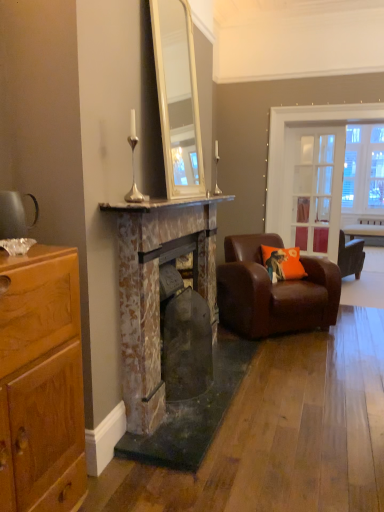
Question: Does point (215, 141) appear closer or farther from the camera than point (155, 204)?

Choices:
 (A) farther
 (B) closer

Answer: (A)

Question: Is silver metallic table lamp at upper center, which is counted as the second table lamp, starting from the left, bigger or smaller than rustic stone fireplace at center, placed as the 1th fireplace when sorted from front to back?

Choices:
 (A) big
 (B) small

Answer: (B)

Question: Estimate the real-world distances between objects in this image. Which object is farther from the shiny brown cabinet at left?

Choices:
 (A) clear glass door at center
 (B) marble mantel at center
 (C) orange fabric pillow at right
 (D) rustic stone fireplace at center, placed as the 2th fireplace when sorted from back to front
 (E) wooden table at right

Answer: (E)

Question: Which object is positioned closest to the silver metallic table lamp at upper center, which is counted as the second table lamp, starting from the front?

Choices:
 (A) rusty stone fireplace at center, acting as the second fireplace starting from the front
 (B) silver metallic candlestick at upper center, which is counted as the 2th table lamp, starting from the right
 (C) shiny brown cabinet at left
 (D) rustic stone fireplace at center, placed as the 1th fireplace when sorted from front to back
 (E) brown leather armchair at right

Answer: (E)